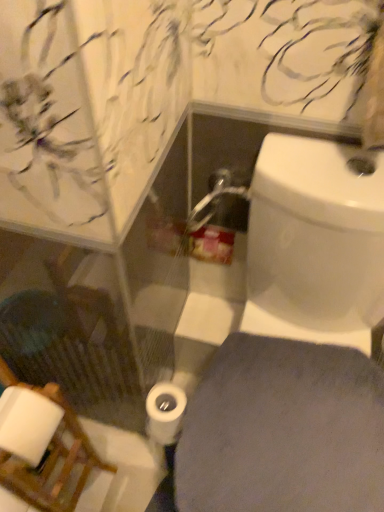
Question: From the image's perspective, is white glossy toilet at lower right located above white matte toilet paper at center?

Choices:
 (A) yes
 (B) no

Answer: (A)

Question: Is white glossy toilet at lower right aimed at white matte toilet paper at center?

Choices:
 (A) no
 (B) yes

Answer: (A)

Question: Is the depth of white glossy toilet at lower right greater than that of white matte toilet paper at center?

Choices:
 (A) no
 (B) yes

Answer: (A)

Question: From a real-world perspective, is white glossy toilet at lower right on white matte toilet paper at center?

Choices:
 (A) no
 (B) yes

Answer: (B)

Question: Does white glossy toilet at lower right touch white matte toilet paper at center?

Choices:
 (A) yes
 (B) no

Answer: (B)

Question: Is white glossy toilet at lower right looking in the opposite direction of white matte toilet paper at center?

Choices:
 (A) no
 (B) yes

Answer: (A)

Question: Does white matte toilet paper at center have a greater width compared to white glossy toilet at lower right?

Choices:
 (A) yes
 (B) no

Answer: (B)

Question: Could you tell me if white matte toilet paper at center is facing white glossy toilet at lower right?

Choices:
 (A) yes
 (B) no

Answer: (B)

Question: Would you consider white matte toilet paper at center to be distant from white glossy toilet at lower right?

Choices:
 (A) yes
 (B) no

Answer: (B)

Question: From a real-world perspective, is white matte toilet paper at center physically above white glossy toilet at lower right?

Choices:
 (A) yes
 (B) no

Answer: (B)

Question: Is white glossy toilet at lower right at the back of white matte toilet paper at center?

Choices:
 (A) yes
 (B) no

Answer: (B)

Question: Is white matte toilet paper at center directly adjacent to white glossy toilet at lower right?

Choices:
 (A) yes
 (B) no

Answer: (B)

Question: Would you say white matte toilet paper at center contains wooden chair at lower left?

Choices:
 (A) yes
 (B) no

Answer: (B)